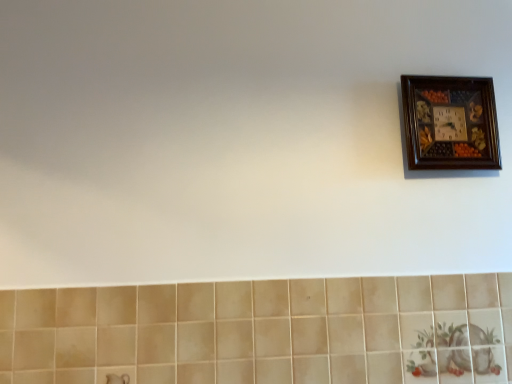
Question: From a real-world perspective, is beige ceramic tile at lower center located higher than wooden clock at upper right?

Choices:
 (A) yes
 (B) no

Answer: (B)

Question: Does beige ceramic tile at lower center have a larger size compared to wooden clock at upper right?

Choices:
 (A) yes
 (B) no

Answer: (A)

Question: Can we say beige ceramic tile at lower center lies outside wooden clock at upper right?

Choices:
 (A) yes
 (B) no

Answer: (A)

Question: Is beige ceramic tile at lower center smaller than wooden clock at upper right?

Choices:
 (A) yes
 (B) no

Answer: (B)

Question: Is beige ceramic tile at lower center positioned in front of wooden clock at upper right?

Choices:
 (A) yes
 (B) no

Answer: (A)

Question: Does beige ceramic tile at lower center have a lesser height compared to wooden clock at upper right?

Choices:
 (A) no
 (B) yes

Answer: (A)

Question: Does wooden clock at upper right have a lesser width compared to beige ceramic tile at lower center?

Choices:
 (A) yes
 (B) no

Answer: (B)

Question: Is wooden clock at upper right in front of beige ceramic tile at lower center?

Choices:
 (A) no
 (B) yes

Answer: (A)

Question: Is wooden clock at upper right facing away from beige ceramic tile at lower center?

Choices:
 (A) no
 (B) yes

Answer: (A)

Question: From a real-world perspective, does wooden clock at upper right sit lower than beige ceramic tile at lower center?

Choices:
 (A) no
 (B) yes

Answer: (A)

Question: Is wooden clock at upper right with beige ceramic tile at lower center?

Choices:
 (A) yes
 (B) no

Answer: (B)

Question: Is wooden clock at upper right outside of beige ceramic tile at lower center?

Choices:
 (A) yes
 (B) no

Answer: (A)

Question: Is wooden clock at upper right bigger or smaller than beige ceramic tile at lower center?

Choices:
 (A) big
 (B) small

Answer: (B)